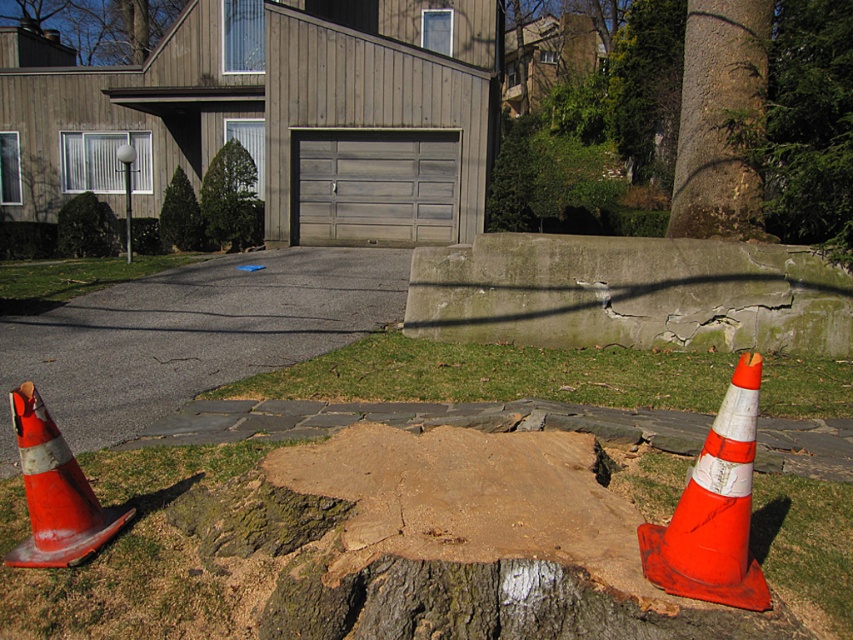
Is smooth brown tree trunk at upper right positioned before smooth brown tree trunk at upper center?

Yes, smooth brown tree trunk at upper right is closer to the viewer.

Who is taller, smooth brown tree trunk at upper right or smooth brown tree trunk at upper center?

smooth brown tree trunk at upper center is taller.

Where is `smooth brown tree trunk at upper right`? Image resolution: width=853 pixels, height=640 pixels. smooth brown tree trunk at upper right is located at coordinates (720, 120).

Can you confirm if smooth brown tree trunk at center is taller than smooth brown tree trunk at upper center?

Correct, smooth brown tree trunk at center is much taller as smooth brown tree trunk at upper center.

The height and width of the screenshot is (640, 853). Identify the location of smooth brown tree trunk at center. (805, 125).

Looking at this image, is the position of smooth brown tree trunk at center more distant than that of green textured evergreen tree at upper center?

No.

Which is below, smooth brown tree trunk at center or green textured evergreen tree at upper center?

Positioned lower is green textured evergreen tree at upper center.

This screenshot has height=640, width=853. What do you see at coordinates (805, 125) in the screenshot?
I see `smooth brown tree trunk at center` at bounding box center [805, 125].

Identify the location of smooth brown tree trunk at center. Image resolution: width=853 pixels, height=640 pixels. (805, 125).